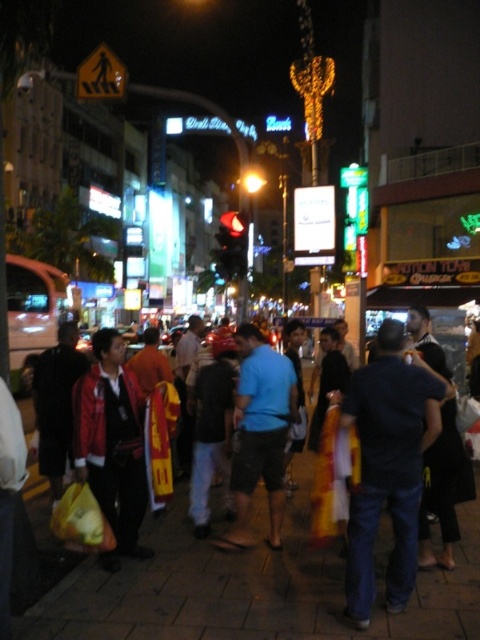
Question: Which point is farther to the camera?

Choices:
 (A) blue cotton shirt at center
 (B) dark blue jeans at center

Answer: (A)

Question: Which point appears farthest from the camera in this image?

Choices:
 (A) (381, 628)
 (B) (274, 436)
 (C) (363, 476)

Answer: (B)

Question: Does dark blue jeans at center have a smaller size compared to blue cotton shirt at center?

Choices:
 (A) no
 (B) yes

Answer: (A)

Question: Among these objects, which one is nearest to the camera?

Choices:
 (A) smooth concrete pavement at center
 (B) blue cotton shirt at center
 (C) dark blue jeans at center

Answer: (A)

Question: Does smooth concrete pavement at center appear on the right side of dark blue jeans at center?

Choices:
 (A) yes
 (B) no

Answer: (B)

Question: Does smooth concrete pavement at center come in front of blue cotton shirt at center?

Choices:
 (A) yes
 (B) no

Answer: (A)